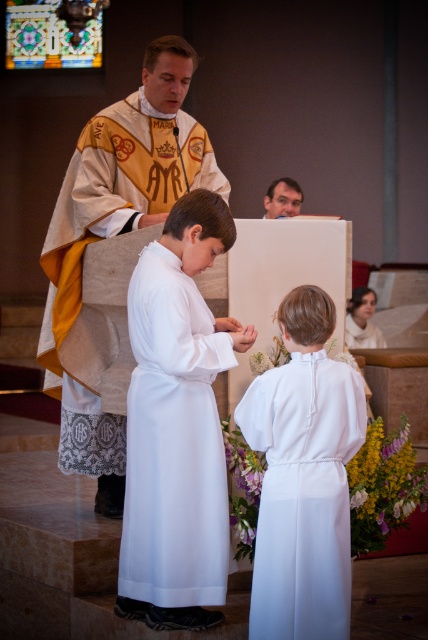
Question: Which object is positioned closest to the smooth skin face at upper center?

Choices:
 (A) gold embroidered robe at center
 (B) white satin robe at center
 (C) white satin robe at lower center

Answer: (A)

Question: Which point is closer to the camera?

Choices:
 (A) click(267, 188)
 (B) click(330, 413)

Answer: (B)

Question: Among these objects, which one is farthest from the camera?

Choices:
 (A) smooth skin face at upper center
 (B) gold embroidered robe at center

Answer: (A)

Question: Can you confirm if white satin robe at center is smaller than smooth skin face at upper center?

Choices:
 (A) no
 (B) yes

Answer: (A)

Question: Does gold embroidered robe at center lie in front of white satin robe at lower center?

Choices:
 (A) yes
 (B) no

Answer: (B)

Question: Can you confirm if white satin robe at center is thinner than gold embroidered robe at center?

Choices:
 (A) yes
 (B) no

Answer: (A)